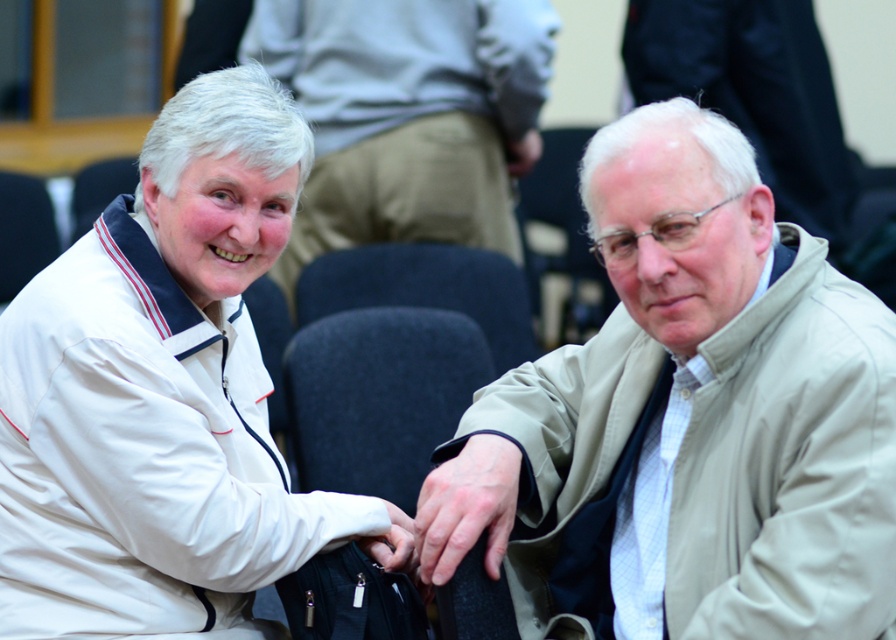
You are a delivery robot with a width of 1.8 meters. You need to move from the dark gray fabric chair at center to the white matte wristband at center. Can you fit through the space between them?

The distance between the dark gray fabric chair at center and the white matte wristband at center is 2.25 meters. Since the robot is 1.8 meters wide, it can fit through the space as the distance is greater than the robot width.

You are a tailor who needs to measure the beige fabric jacket at right and the white matte wristband at center for alterations. Which item requires a larger measurement tape? Explain your reasoning based on the items shown in the image.

The beige fabric jacket at right requires a larger measurement tape because it is bigger than the white matte wristband at center.

You are a tailor measuring items for a display. You have to place both the dark gray fabric chair at center and the white matte wristband at center on a shelf. Which object requires a wider space on the shelf?

The dark gray fabric chair at center requires a wider space on the shelf since its width surpasses that of the white matte wristband at center.